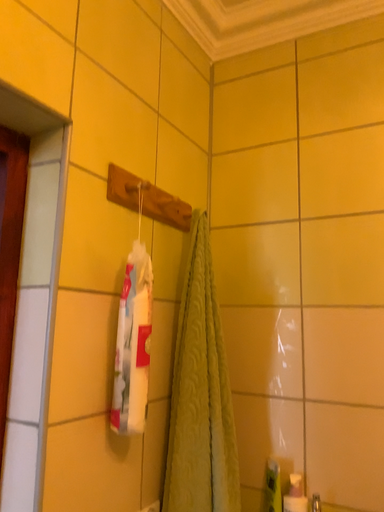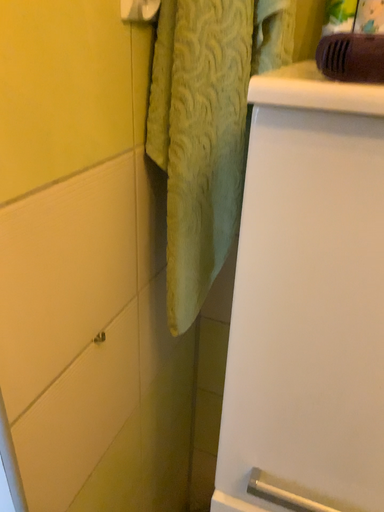
Question: How did the camera likely rotate when shooting the video?

Choices:
 (A) rotated upward
 (B) rotated downward

Answer: (B)